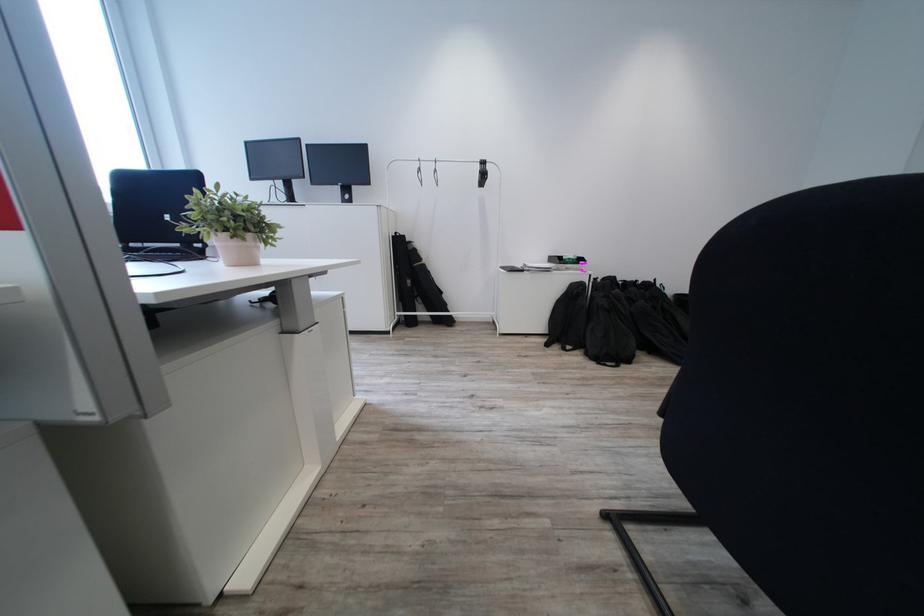
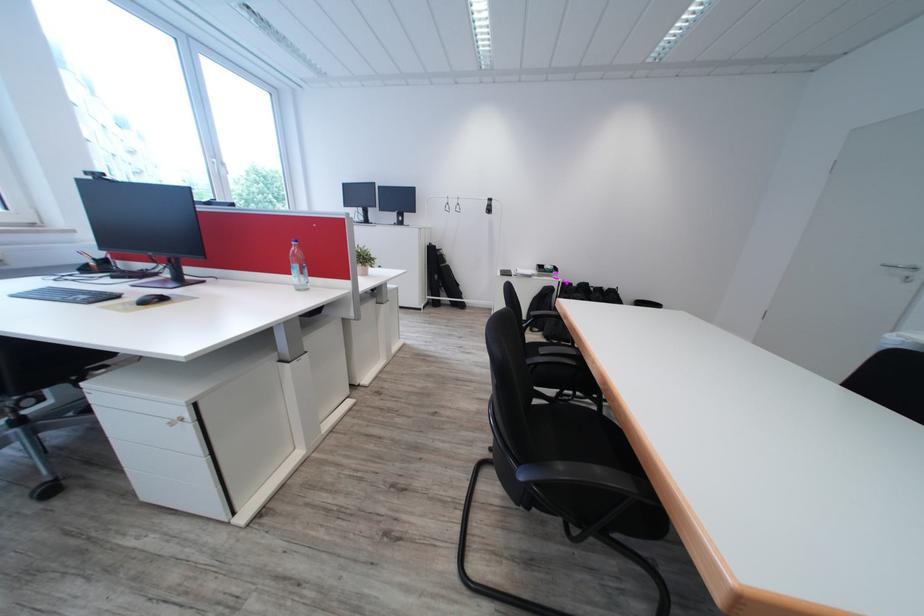
In the second image, find the point that corresponds to point (237, 216) in the first image.

(372, 259)